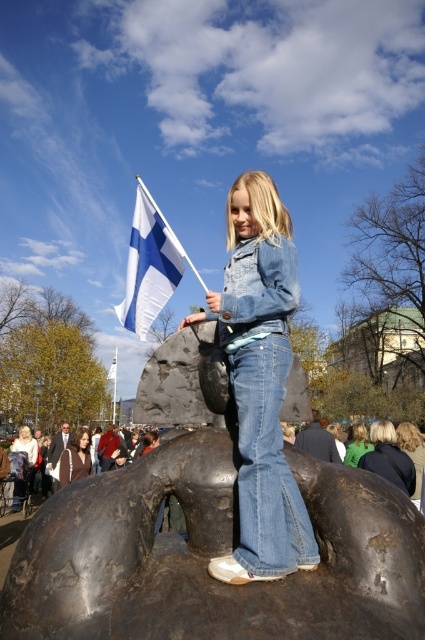
Question: Does bronze sculpture at center appear on the right side of denim jacket at center?

Choices:
 (A) no
 (B) yes

Answer: (A)

Question: Considering the relative positions of denim jacket at center and white fabric flag at upper left in the image provided, where is denim jacket at center located with respect to white fabric flag at upper left?

Choices:
 (A) below
 (B) above

Answer: (B)

Question: Does bronze sculpture at center come behind white fabric flag at upper left?

Choices:
 (A) no
 (B) yes

Answer: (A)

Question: Which object is the farthest from the white fabric flag at upper left?

Choices:
 (A) denim jacket at center
 (B) bronze sculpture at center

Answer: (B)

Question: Which object appears farthest from the camera in this image?

Choices:
 (A) white fabric flag at upper left
 (B) bronze sculpture at center
 (C) denim jacket at center

Answer: (A)

Question: Which object is the closest to the denim jacket at center?

Choices:
 (A) white fabric flag at upper left
 (B) bronze sculpture at center

Answer: (B)